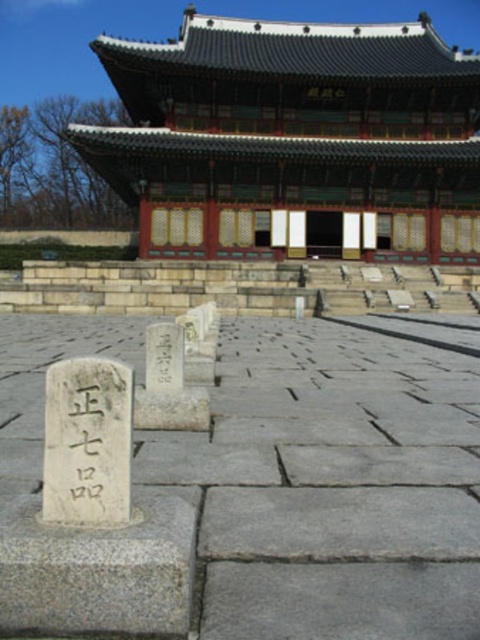
You are a tourist visiting the palace and want to take a photo of both the white stone marker at center and the green wooden palace at upper center. Based on their positions, which object should you focus on first to ensure both are in the frame?

The white stone marker at center is positioned on the left side of the green wooden palace at upper center, so you should focus on the green wooden palace at upper center first to ensure both are in the frame.

You are a historian visiting the palace and notice two objects on the ground. The white stone marker at center and the black stone writing at center. Which one do you think is bigger?

The white stone marker at center is larger in size compared to the black stone writing at center.

You are a tourist visiting the palace and want to take a photo of both the black stone writings. Since you want to include the palace in the background, you need to position yourself so that both writings are visible in your camera frame. Based on their positions, which direction should you move to ensure both the black stone writing at lower left and the black stone writing at center are in your view?

The black stone writing at lower left is to the right of the black stone writing at center, so you should position yourself to the left side of the black stone writing at center to include both in your camera frame.